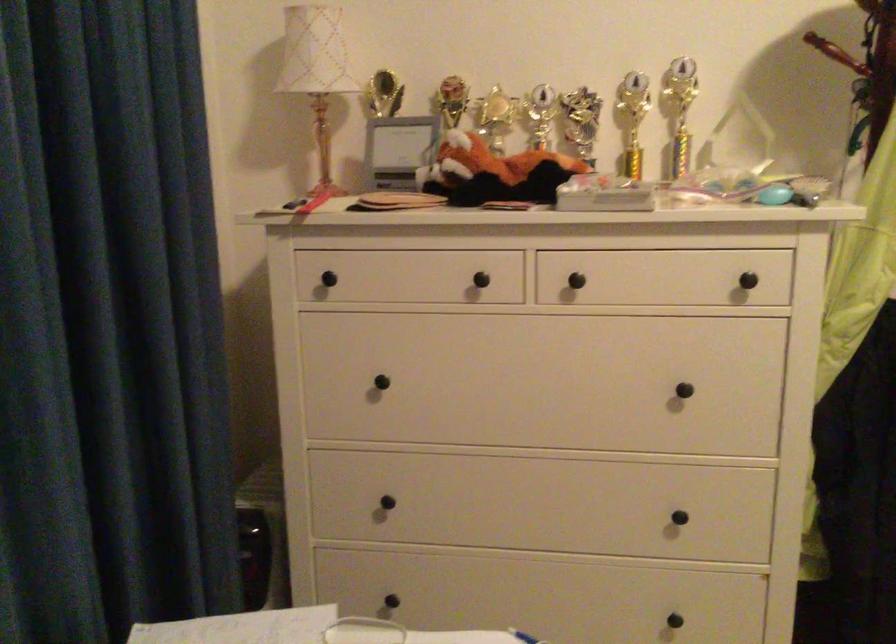
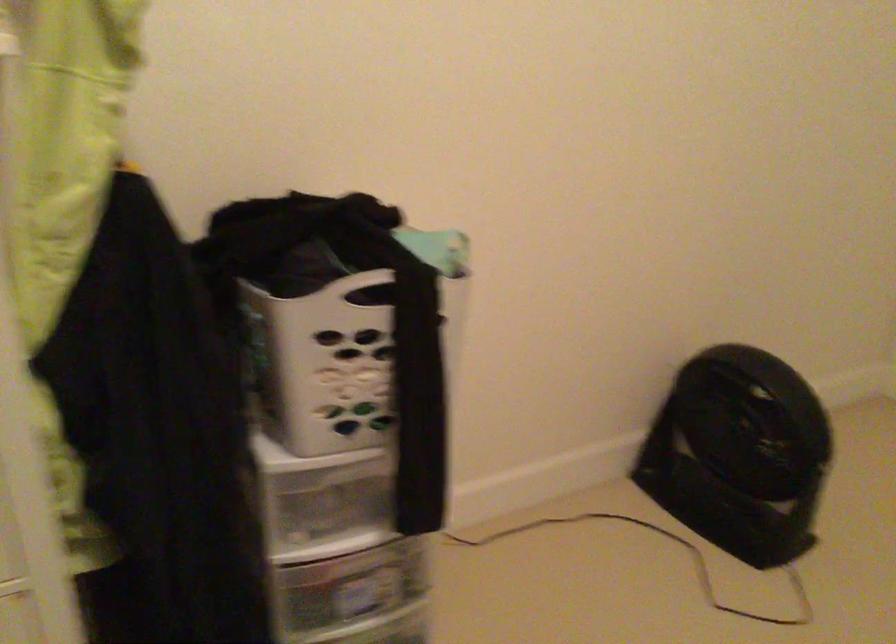
Question: How did the camera likely rotate?

Choices:
 (A) Left
 (B) Right
 (C) Up
 (D) Down

Answer: (B)